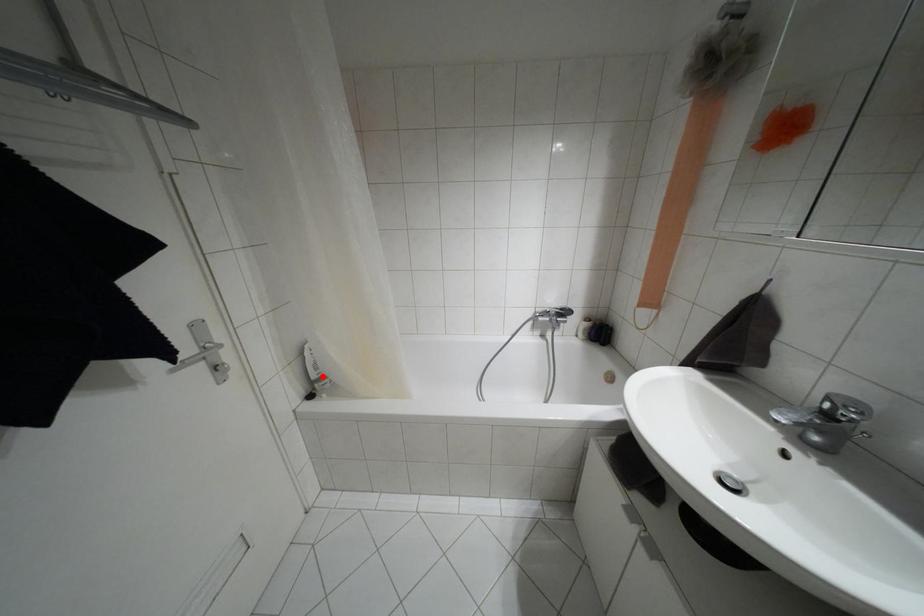
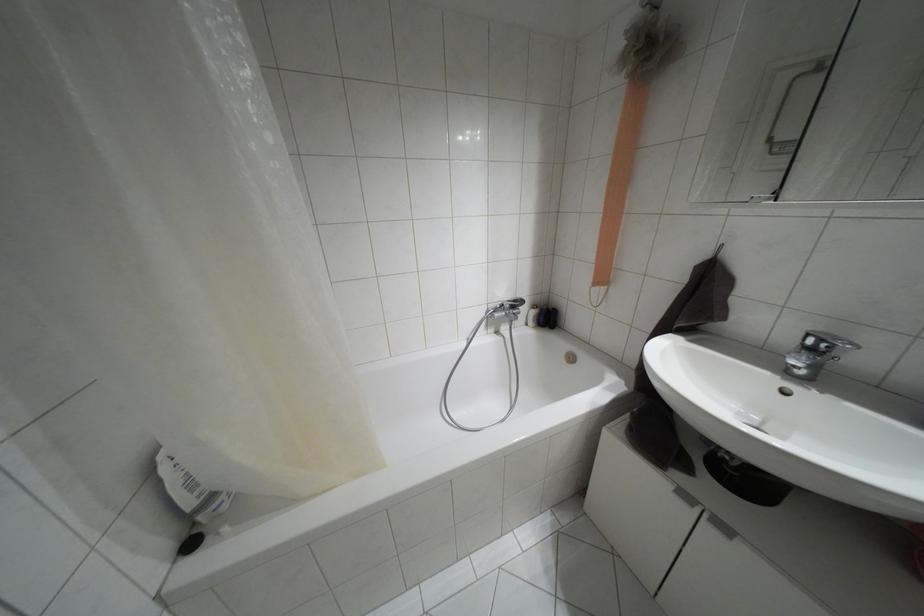
Question: A red point is marked in image1. In image2, is the corresponding 3D point closer to the camera or farther? Reply with the corresponding letter.

Choices:
 (A) The corresponding 3D point is closer.
 (B) The corresponding 3D point is farther.

Answer: (A)